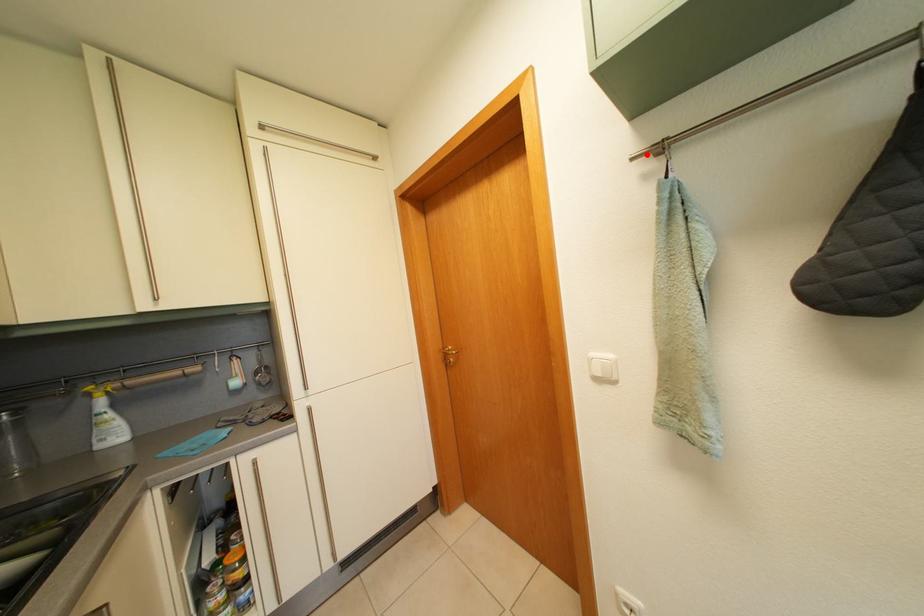
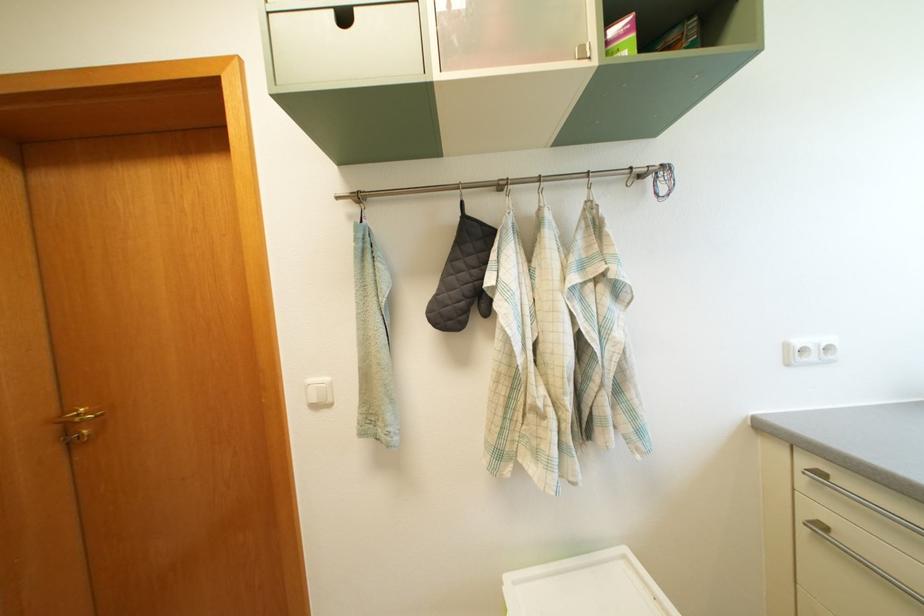
Question: I am providing you with two images of the same scene from different viewpoints. A red point is marked on the first image. At the location where the point appears in image 1, is it still visible in image 2?

Choices:
 (A) Yes
 (B) No

Answer: (A)